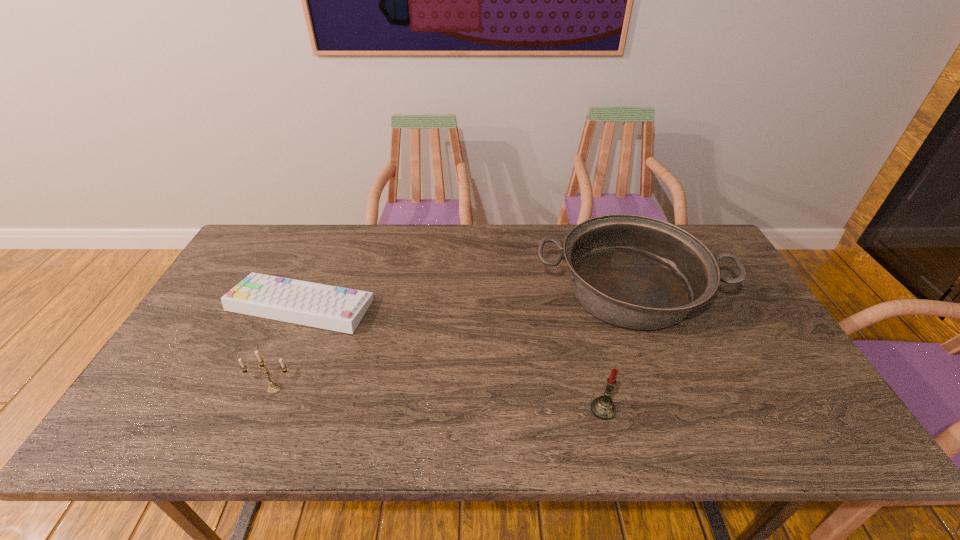
What are the coordinates of `the nearest object` in the screenshot? It's located at (602, 407).

Where is `the nearer candle`? This screenshot has width=960, height=540. the nearer candle is located at coordinates (602, 407).

Locate an element on the screen. The height and width of the screenshot is (540, 960). pan is located at coordinates (637, 272).

Locate an element on the screen. the second nearest object is located at coordinates (274, 387).

Find the location of a particular element. the left candle is located at coordinates (274, 387).

At what (x,y) coordinates should I click in order to perform the action: click on computer keyboard. Please return your answer as a coordinate pair (x, y). Looking at the image, I should click on (317, 305).

I want to click on free space located on the left of the right candle, so click(x=491, y=409).

In order to click on free point located on the front of the pan in this screenshot , I will do tap(677, 418).

At what (x,y) coordinates should I click in order to perform the action: click on free space located on the left of the third farthest object. Please return your answer as a coordinate pair (x, y). The image size is (960, 540). Looking at the image, I should click on (227, 388).

At what (x,y) coordinates should I click in order to perform the action: click on free space located on the back of the computer keyboard. Please return your answer as a coordinate pair (x, y). The image size is (960, 540). Looking at the image, I should click on (333, 231).